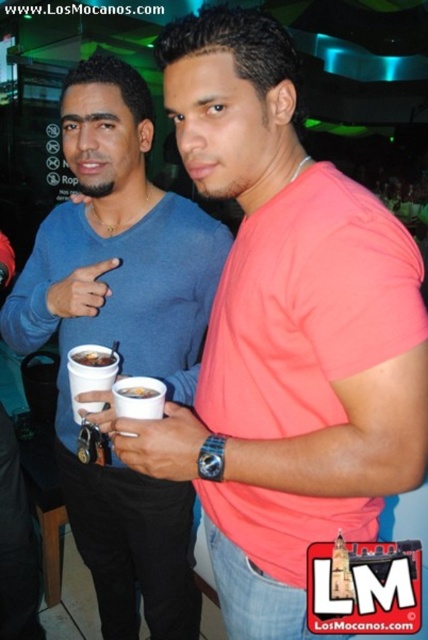
Question: Which of these objects is positioned closest to the white paper cup at center?

Choices:
 (A) blue matte shirt at center
 (B) white matte cup at center

Answer: (B)

Question: Does blue matte shirt at center appear under white matte cup at center?

Choices:
 (A) no
 (B) yes

Answer: (B)

Question: Which object appears closest to the camera in this image?

Choices:
 (A) white paper cup at center
 (B) blue matte shirt at center
 (C) white matte cup at center

Answer: (C)

Question: Which point is farther to the camera?

Choices:
 (A) white matte cup at center
 (B) blue matte shirt at center
 (C) white paper cup at center

Answer: (C)

Question: Can you confirm if white paper cup at center is positioned below white matte cup at center?

Choices:
 (A) no
 (B) yes

Answer: (A)

Question: Can you confirm if blue matte shirt at center is positioned to the left of white matte cup at center?

Choices:
 (A) no
 (B) yes

Answer: (B)